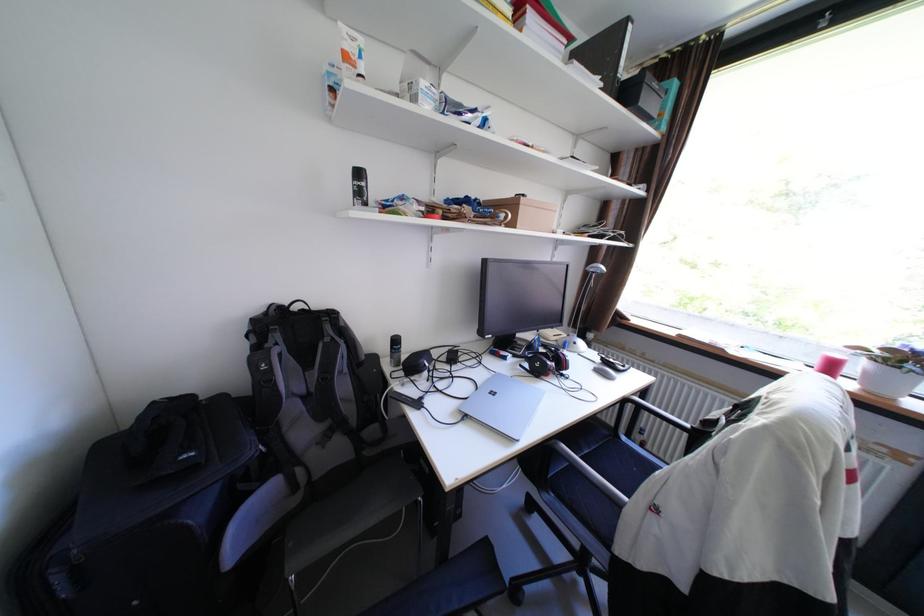
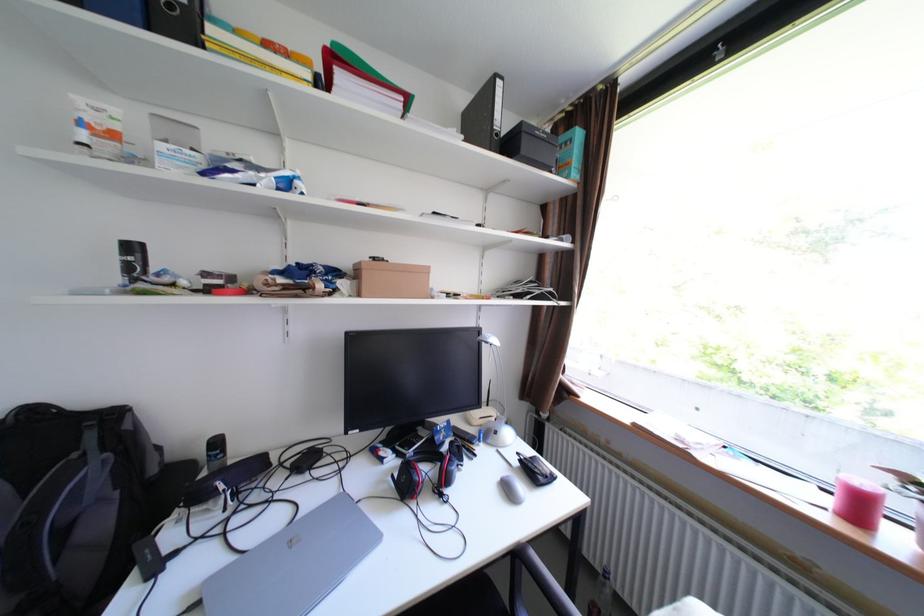
Find the pixel in the second image that matches point (438, 365) in the first image.

(233, 488)